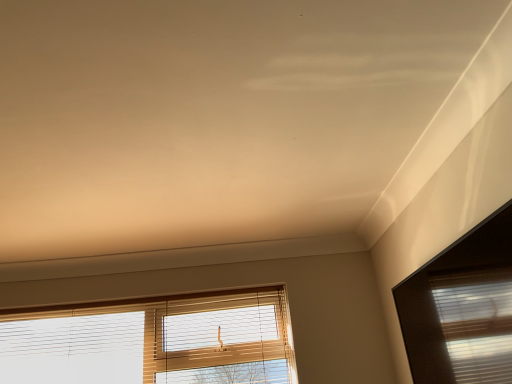
Question: Is matte glass window at upper right, acting as the first window starting from the right, to the left or to the right of wooden blinds at lower center, the 1th window in the back-to-front sequence, in the image?

Choices:
 (A) right
 (B) left

Answer: (A)

Question: From their relative heights in the image, would you say matte glass window at upper right, the second window from the left, is taller or shorter than wooden blinds at lower center, arranged as the second window when viewed from the front?

Choices:
 (A) tall
 (B) short

Answer: (B)

Question: Looking at their shapes, would you say matte glass window at upper right, the second window from the left, is wider or thinner than wooden blinds at lower center, arranged as the second window when viewed from the front?

Choices:
 (A) wide
 (B) thin

Answer: (B)

Question: Considering their positions, is wooden blinds at lower center, which is the second window in right-to-left order, located in front of or behind matte glass window at upper right, acting as the first window starting from the right?

Choices:
 (A) front
 (B) behind

Answer: (B)

Question: In terms of width, does wooden blinds at lower center, the first window viewed from the left, look wider or thinner when compared to matte glass window at upper right, acting as the first window starting from the right?

Choices:
 (A) thin
 (B) wide

Answer: (B)

Question: Based on their sizes in the image, would you say wooden blinds at lower center, the first window viewed from the left, is bigger or smaller than matte glass window at upper right, acting as the first window starting from the right?

Choices:
 (A) small
 (B) big

Answer: (B)

Question: From the image's perspective, relative to matte glass window at upper right, the first window in the front-to-back sequence, is wooden blinds at lower center, the 1th window in the back-to-front sequence, above or below?

Choices:
 (A) above
 (B) below

Answer: (B)